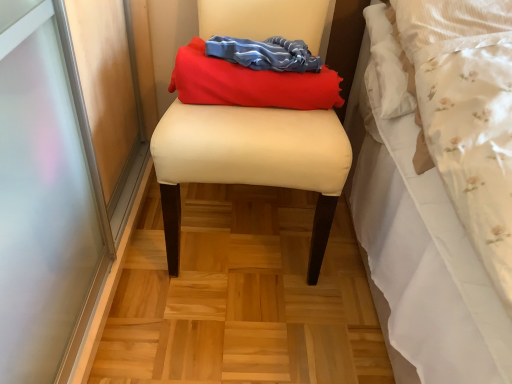
Where is `vacant space underneath beige fabric stool at center (from a real-world perspective)`? vacant space underneath beige fabric stool at center (from a real-world perspective) is located at coordinates (247, 224).